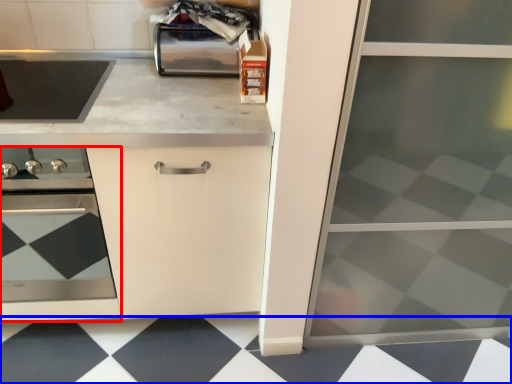
Question: Which of the following is the farthest to the observer, home appliance (highlighted by a red box) or tile (highlighted by a blue box)?

Choices:
 (A) home appliance
 (B) tile

Answer: (B)